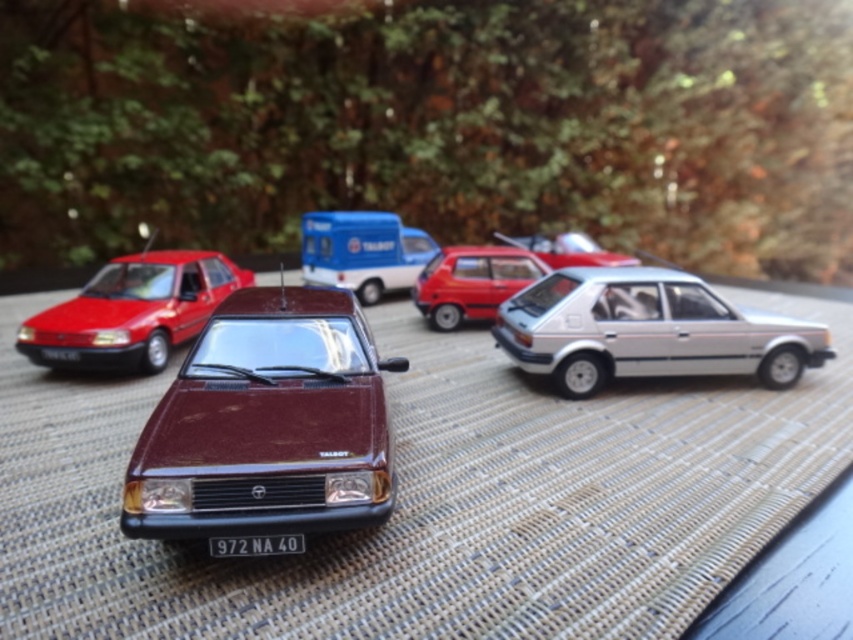
Is silver metallic hatchback at right smaller than matte red car at left?

Indeed, silver metallic hatchback at right has a smaller size compared to matte red car at left.

Does silver metallic hatchback at right have a greater width compared to matte red car at left?

Correct, the width of silver metallic hatchback at right exceeds that of matte red car at left.

Does point (634, 269) come in front of point (167, 342)?

Yes.

Where is `silver metallic hatchback at right`? The height and width of the screenshot is (640, 853). silver metallic hatchback at right is located at coordinates (648, 330).

Is point (357, 244) positioned after point (566, 237)?

That is False.

In the scene shown: Does blue metallic van at center have a greater height compared to metallic red hatchback at center?

Yes, blue metallic van at center is taller than metallic red hatchback at center.

Describe the element at coordinates (363, 252) in the screenshot. This screenshot has width=853, height=640. I see `blue metallic van at center` at that location.

Identify the location of blue metallic van at center. (363, 252).

What do you see at coordinates (363, 252) in the screenshot? This screenshot has width=853, height=640. I see `blue metallic van at center` at bounding box center [363, 252].

What do you see at coordinates (363, 252) in the screenshot?
I see `blue metallic van at center` at bounding box center [363, 252].

This screenshot has width=853, height=640. Identify the location of blue metallic van at center. (363, 252).